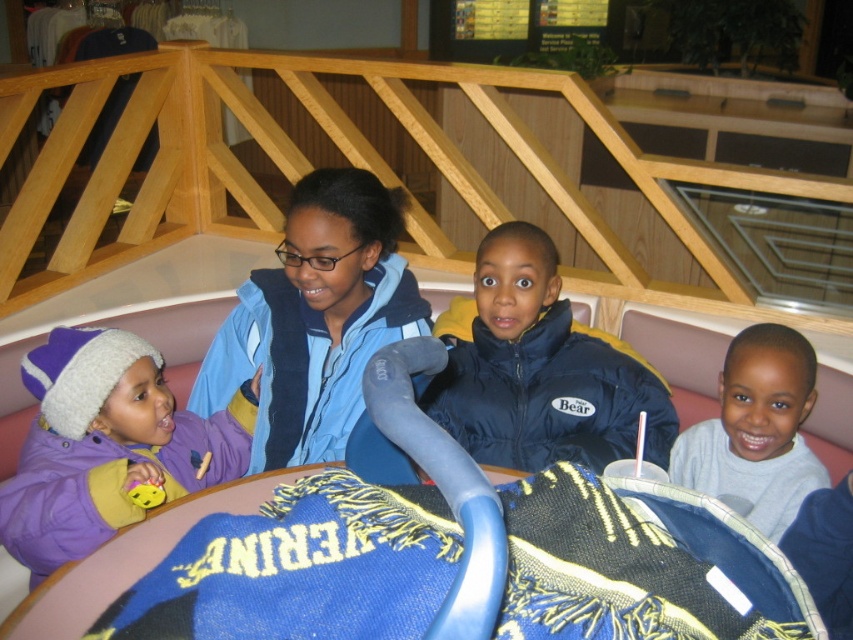
You are a photographer trying to capture a candid shot of the children in the scene. You notice a point at coordinates (538, 369) where the navy blue puffer jacket at center is located. If you want to include all four children in your photo, should you adjust your camera to focus closer or farther from this point?

The navy blue puffer jacket at center is located at point (538, 369). To include all four children in the photo, you should adjust your camera to focus farther from this point to capture the entire group.

You are a photographer trying to capture a group photo of the navy blue puffer jacket at center and the gray cotton shirt at lower right. Based on their positions, which one should you focus on first to ensure they are both in frame?

The navy blue puffer jacket at center is much taller than the gray cotton shirt at lower right, so you should focus on the navy blue puffer jacket at center first to ensure both are in frame.